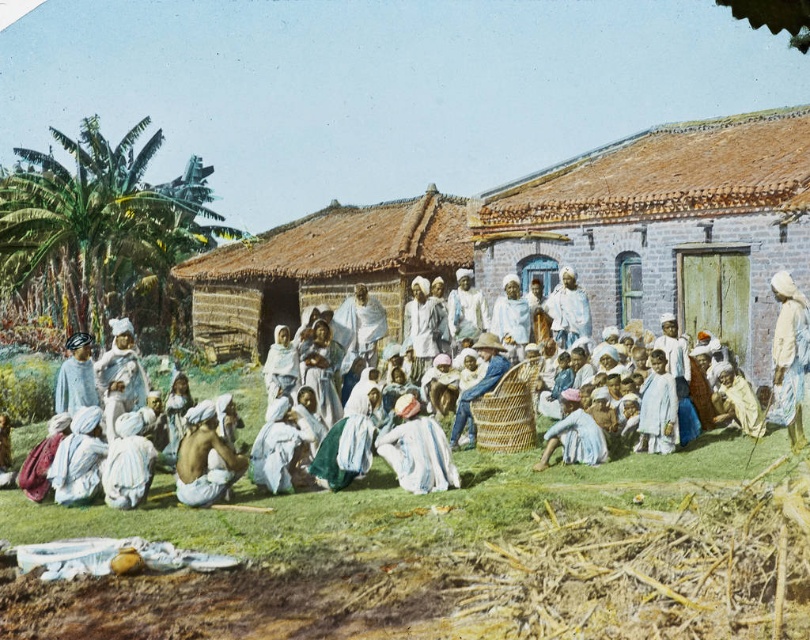
You are a traveler who wants to know if the light blue fabric at center is covering the light brown skin at center. Can you confirm?

The light blue fabric at center is positioned over light brown skin at center, so yes, the light blue fabric at center is covering the light brown skin at center.